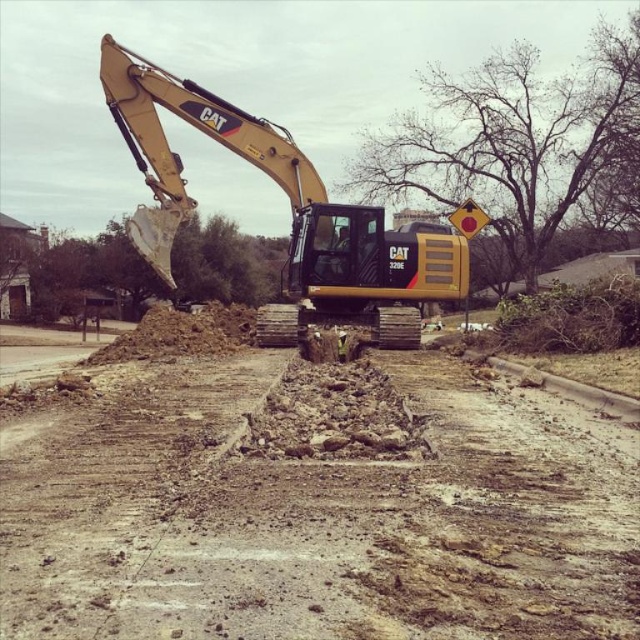
From the picture: You are a delivery driver who needs to navigate through the construction area shown in the image. You see the brown gravel dirt track at center. Can you determine if this track is suitable for your delivery truck?

The brown gravel dirt track at center is located at point (316, 509), but without information about its width or load capacity, it is not possible to determine if it is suitable for your delivery truck.

You are a delivery driver who needs to drive your truck along the brown gravel dirt track at center to reach the construction site. However, the yellow metallic excavator at center is blocking the track. Can you drive around the excavator to continue on the track?

The brown gravel dirt track at center is below the yellow metallic excavator at center, meaning the excavator is positioned over the track. To continue driving on the track, you would need to maneuver around the excavator either to its front or rear, as the track is directly beneath it and currently blocked.

You are a delivery truck driver who needs to pass by the yellow metallic excavator at center. The truck requires a minimum of 10 meters of clearance to safely navigate around it. Is the brown gravel dirt track at center sufficient for your truck to pass safely?

The brown gravel dirt track at center is 9.80 meters from the yellow metallic excavator at center. Since the required clearance is 10 meters, the track is not wide enough for the truck to pass safely.